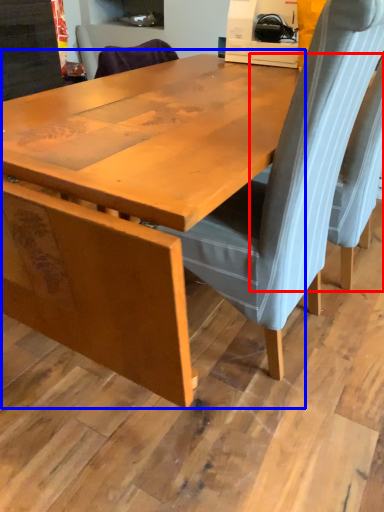
Question: Which object is closer to the camera taking this photo, chair (highlighted by a red box) or table (highlighted by a blue box)?

Choices:
 (A) chair
 (B) table

Answer: (B)